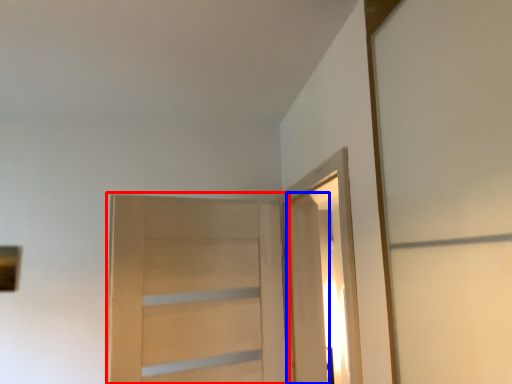
Question: Which object appears farthest to the camera in this image, door (highlighted by a red box) or door (highlighted by a blue box)?

Choices:
 (A) door
 (B) door

Answer: (B)